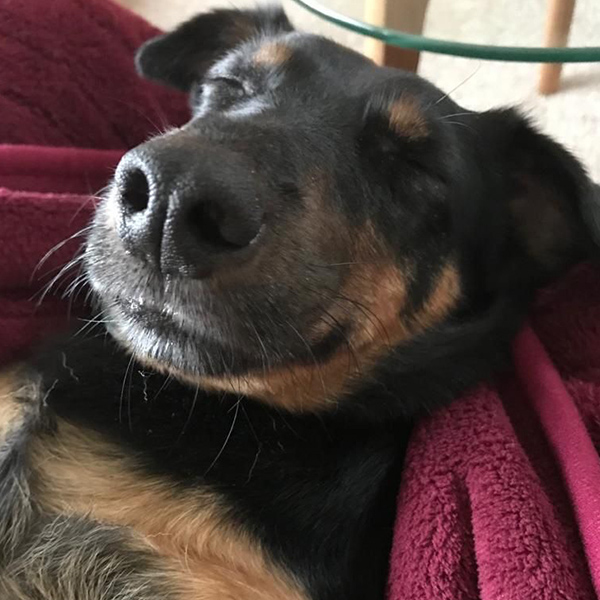
You are a GUI agent. You are given a task and a screenshot of the screen. Output one action in this format:
    pyautogui.click(x=<x>, y=<y>)
    Task: Click on the table
    
    Given the screenshot: What is the action you would take?
    pyautogui.click(x=457, y=18)